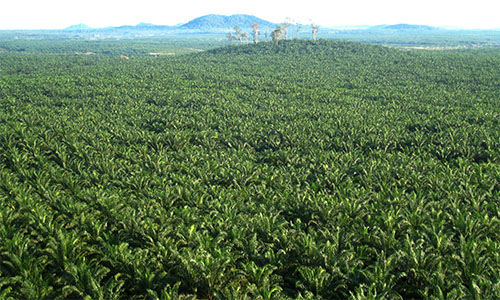
What are the coordinates of `corner` in the screenshot? It's located at (483, 290), (8, 291), (18, 26), (492, 2).